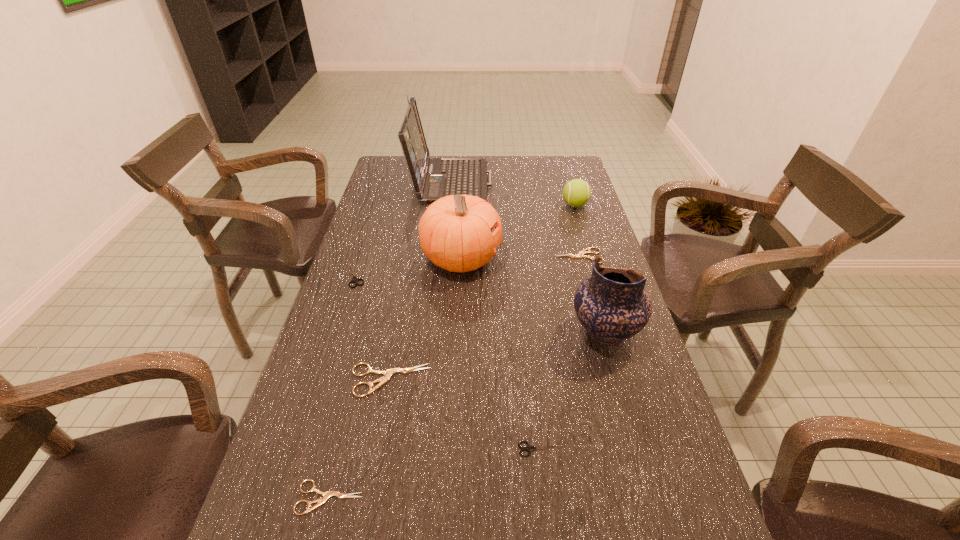
Where is `free spot that satisfies the following two spatial constraints: 1. on the front-facing side of the fourth nearest object; 2. on the right side of the laptop computer`? This screenshot has width=960, height=540. free spot that satisfies the following two spatial constraints: 1. on the front-facing side of the fourth nearest object; 2. on the right side of the laptop computer is located at coordinates (435, 333).

The width and height of the screenshot is (960, 540). I want to click on vacant region that satisfies the following two spatial constraints: 1. on the back side of the fourth farthest shears; 2. on the right side of the sixth farthest object, so pos(529,333).

The width and height of the screenshot is (960, 540). Identify the location of free space in the image that satisfies the following two spatial constraints: 1. on the back side of the second smallest beige shears; 2. on the right side of the second nearest shears. (520, 256).

Identify the location of free space in the image that satisfies the following two spatial constraints: 1. on the front-facing side of the tallest object; 2. on the back side of the green tennis ball. (448, 205).